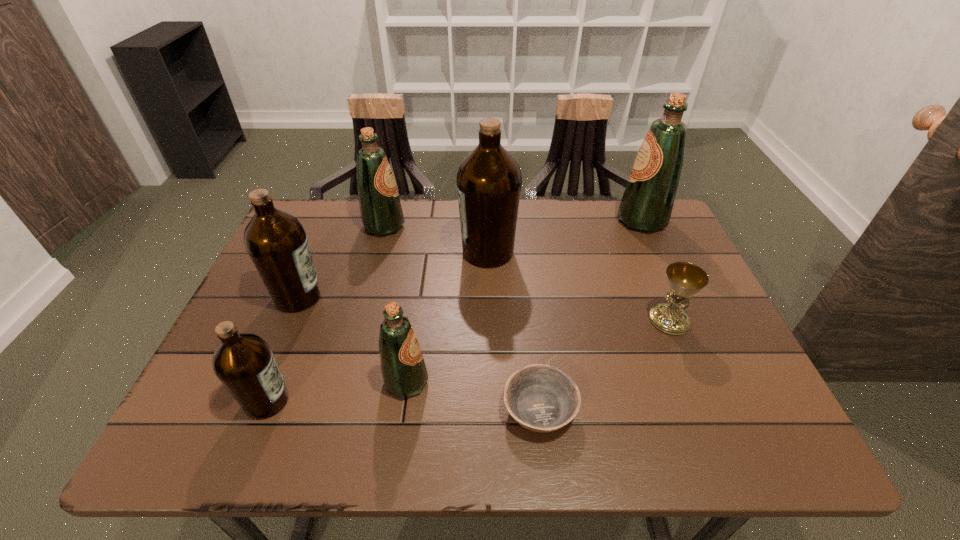
Locate an element on the screen. the smallest brown olive oil is located at coordinates (244, 363).

Locate an element on the screen. This screenshot has height=540, width=960. chalice is located at coordinates [685, 279].

In order to click on the shortest object in this screenshot , I will do `click(541, 398)`.

What are the coordinates of `vacant region located on the label of the farthest brown olive oil` in the screenshot? It's located at (409, 252).

Where is `free space located 0.140m on the label of the farthest brown olive oil`? The image size is (960, 540). free space located 0.140m on the label of the farthest brown olive oil is located at coordinates [409, 252].

You are a GUI agent. You are given a task and a screenshot of the screen. Output one action in this format:
    pyautogui.click(x=<x>, y=<y>)
    Task: Click on the free point located 0.070m on the label of the farthest brown olive oil
    Image resolution: width=960 pixels, height=540 pixels.
    Given the screenshot: What is the action you would take?
    pyautogui.click(x=434, y=252)

The height and width of the screenshot is (540, 960). Find the location of `vacant area situated 0.050m on the front-facing side of the biggest green olive oil`. vacant area situated 0.050m on the front-facing side of the biggest green olive oil is located at coordinates (599, 220).

Find the location of a particular element. vacant space located on the front-facing side of the biggest green olive oil is located at coordinates (599, 220).

Where is `vacant area situated 0.190m on the front-facing side of the biggest green olive oil`? This screenshot has height=540, width=960. vacant area situated 0.190m on the front-facing side of the biggest green olive oil is located at coordinates (553, 220).

The image size is (960, 540). I want to click on free space located on the front-facing side of the second smallest green olive oil, so click(x=530, y=226).